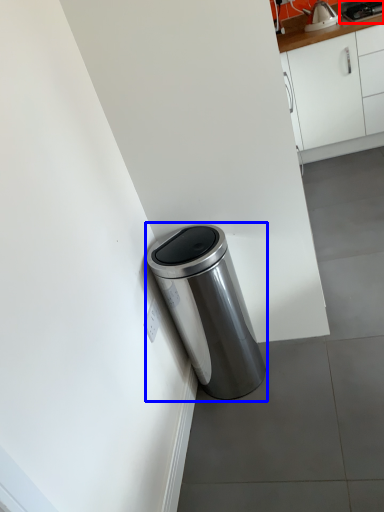
Question: Which object is closer to the camera taking this photo, appliance (highlighted by a red box) or waste container (highlighted by a blue box)?

Choices:
 (A) appliance
 (B) waste container

Answer: (B)